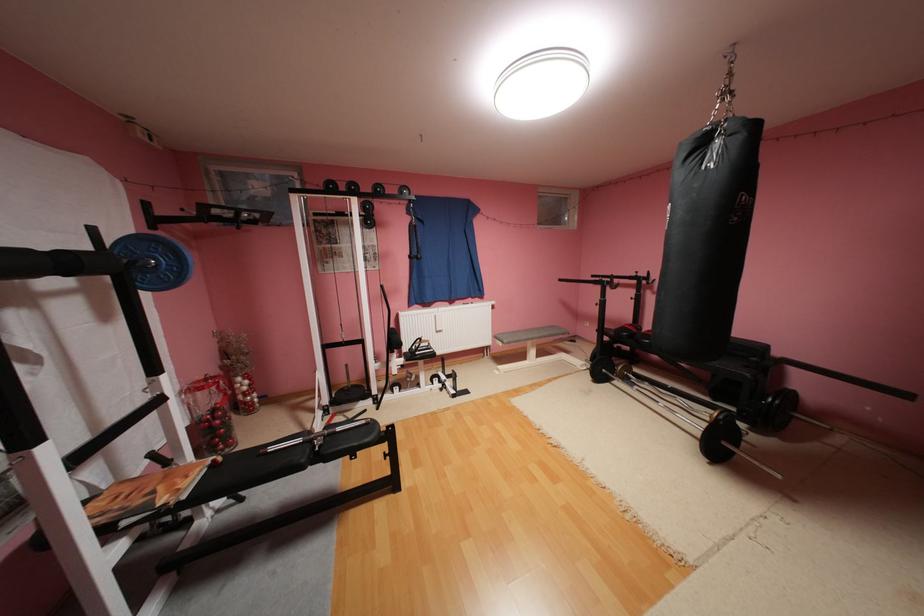
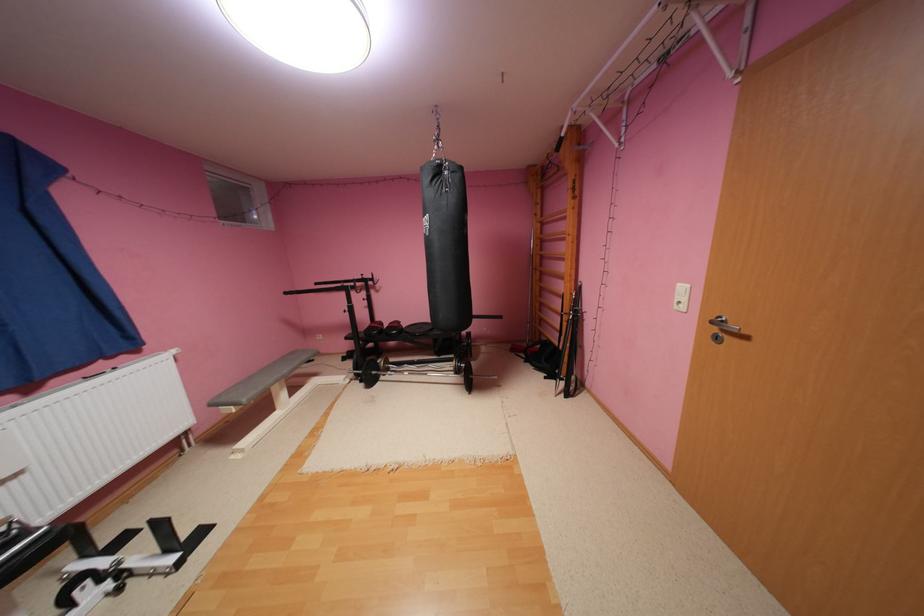
Locate, in the second image, the point that corresponds to the point at 634,379 in the first image.

(396, 371)